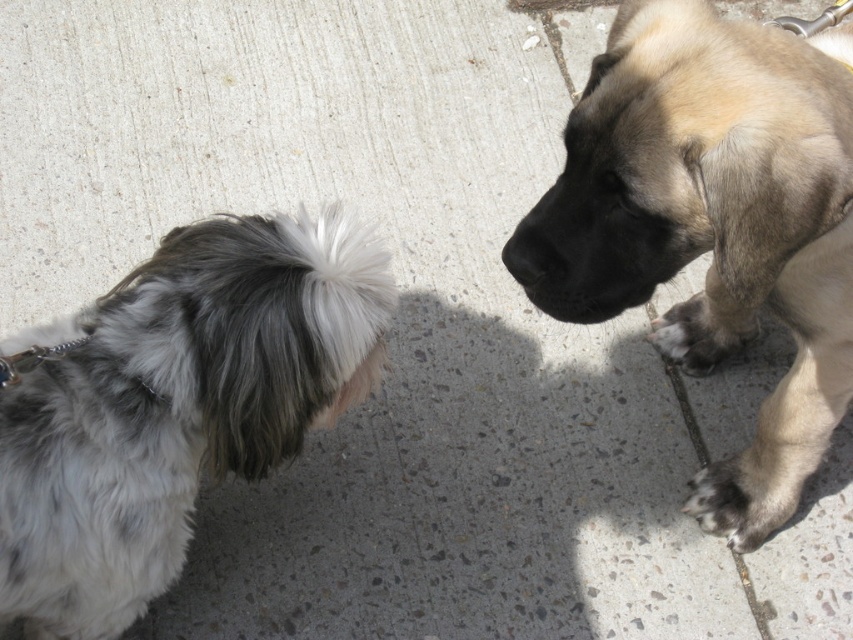
You are a dog owner observing two paws on the ground in front of you. You notice a dark brown fur paw at lower right and a fuzzy beige paw at lower right. Which paw is wider?

The fuzzy beige paw at lower right is wider than the dark brown fur paw at lower right.

You are standing at the center of the image and want to locate the gray and white fur at left. According to the coordinates provided, in which direction should you look to find it?

The gray and white fur at left is located at coordinates point (175, 404), so you should look to the left side of the image to find it.

You are a dog owner trying to identify which of your dogs is taller. You have two dogs in the image. Which dog, the gray and white fur at left or the fuzzy beige paw at lower right, is taller?

The gray and white fur at left is taller than the fuzzy beige paw at lower right.